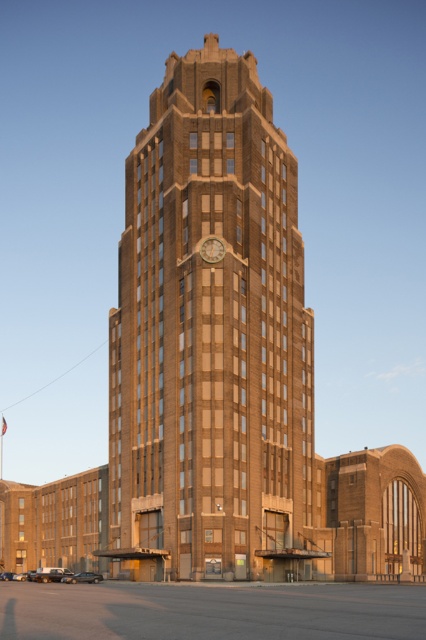
Does brown brick tower at center have a larger size compared to wooden clock at center?

Yes, brown brick tower at center is bigger than wooden clock at center.

Image resolution: width=426 pixels, height=640 pixels. What do you see at coordinates (212, 340) in the screenshot?
I see `brown brick tower at center` at bounding box center [212, 340].

Measure the distance between point (187, 496) and camera.

They are 76.43 meters apart.

Locate an element on the screen. This screenshot has width=426, height=640. brown brick tower at center is located at coordinates (212, 340).